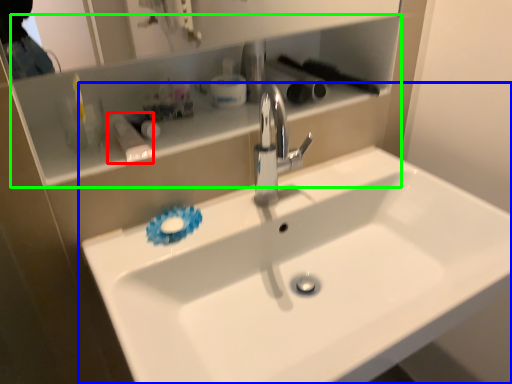
Question: Which object is the closest to the toiletry (highlighted by a red box)? Choose among these: sink (highlighted by a blue box) or cabinet (highlighted by a green box).

Choices:
 (A) sink
 (B) cabinet

Answer: (B)